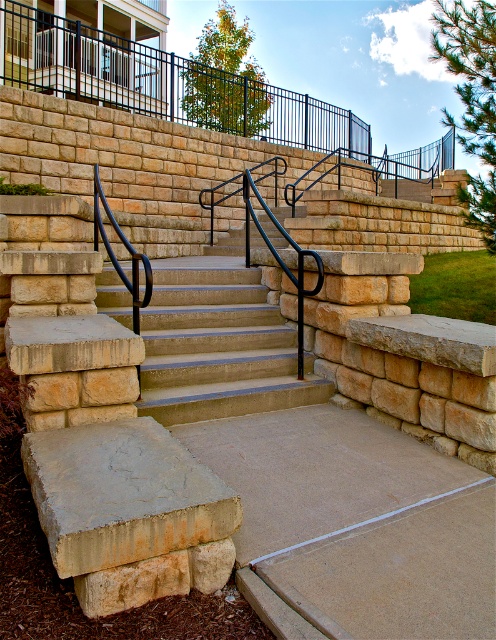
Question: Which object appears farthest from the camera in this image?

Choices:
 (A) smooth stone stairs at center
 (B) black metal railing at upper center

Answer: (B)

Question: Is black metal railing at upper center positioned behind smooth stone stairs at center?

Choices:
 (A) no
 (B) yes

Answer: (B)

Question: Which point is closer to the camera?

Choices:
 (A) black metal railing at upper center
 (B) smooth stone stairs at center

Answer: (B)

Question: Which point appears closest to the camera in this image?

Choices:
 (A) (142, 365)
 (B) (122, 88)

Answer: (A)

Question: Does black metal railing at upper center appear under smooth stone stairs at center?

Choices:
 (A) yes
 (B) no

Answer: (B)

Question: In this image, where is black metal railing at upper center located relative to smooth stone stairs at center?

Choices:
 (A) right
 (B) left

Answer: (A)